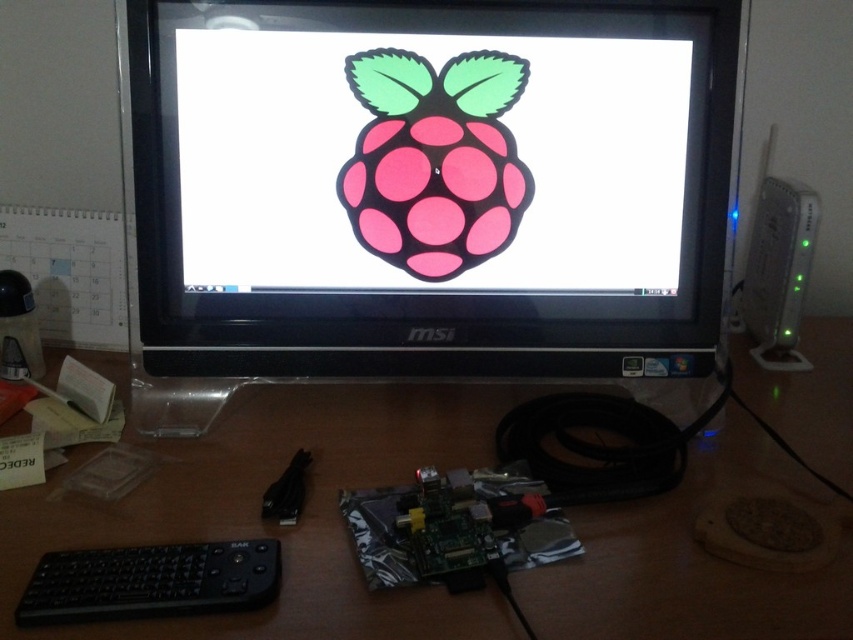
Locate an element on the screen. black plastic monitor at center is located at coordinates (430, 186).

Is point (463, 99) positioned after point (83, 608)?

Yes, point (463, 99) is behind point (83, 608).

I want to click on black plastic monitor at center, so click(x=430, y=186).

Does black plastic monitor at center have a greater width compared to wooden at center?

In fact, black plastic monitor at center might be narrower than wooden at center.

Is point (222, 193) less distant than point (593, 561)?

No, it is not.

You are a GUI agent. You are given a task and a screenshot of the screen. Output one action in this format:
    pyautogui.click(x=<x>, y=<y>)
    Task: Click on the black plastic monitor at center
    The image size is (853, 640).
    Given the screenshot: What is the action you would take?
    pyautogui.click(x=430, y=186)

Who is shorter, wooden at center or black matte keyboard at lower left?

Standing shorter between the two is black matte keyboard at lower left.

Is wooden at center taller than black matte keyboard at lower left?

Yes.

Is point (403, 451) closer to viewer compared to point (212, 552)?

No, it is behind (212, 552).

Locate an element on the screen. wooden at center is located at coordinates (273, 524).